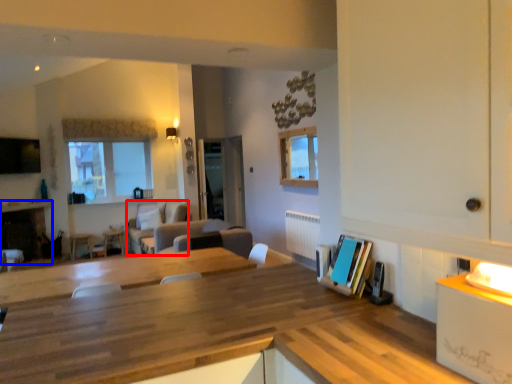
Question: Which object appears farthest to the camera in this image, couch (highlighted by a red box) or fireplace (highlighted by a blue box)?

Choices:
 (A) couch
 (B) fireplace

Answer: (A)